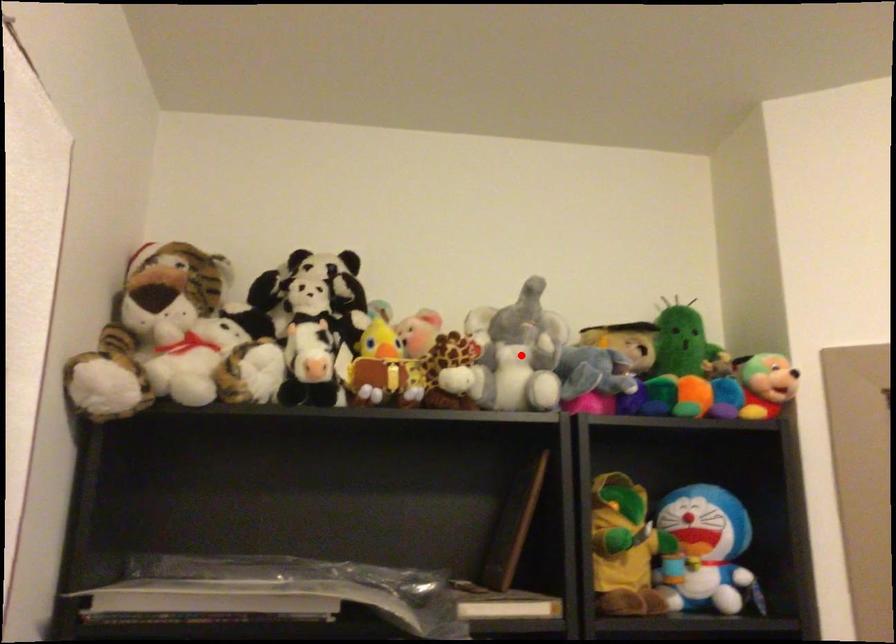
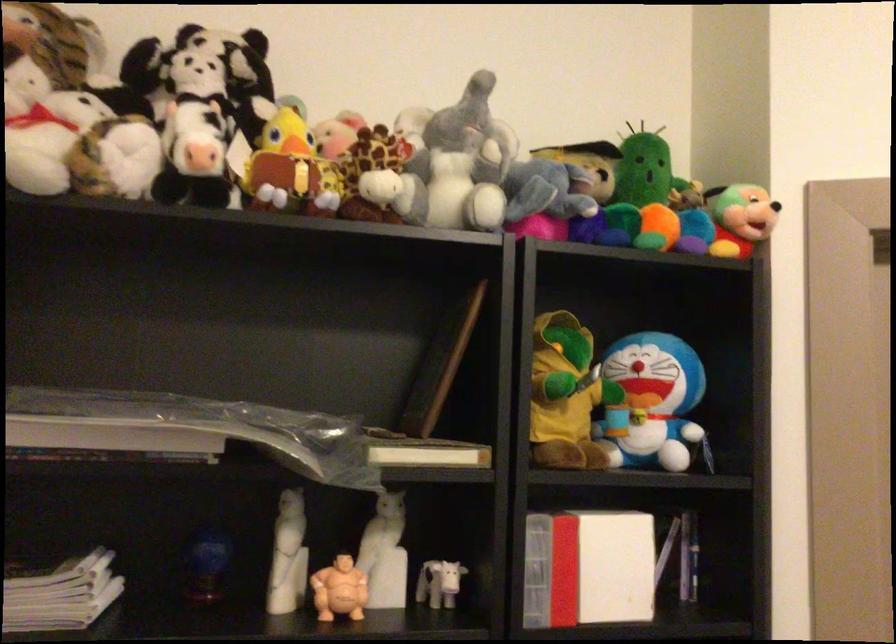
Question: I am providing you with two images of the same scene from different viewpoints. In image1, a red point is highlighted. Considering the same 3D point in image2, which of the following is correct?

Choices:
 (A) It is closer
 (B) It is farther

Answer: (A)